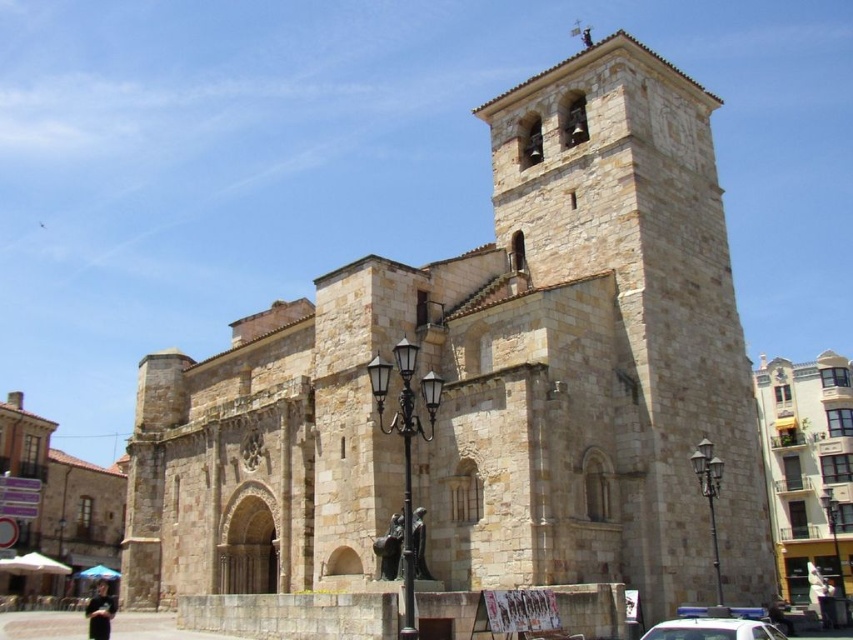
This screenshot has width=853, height=640. Describe the element at coordinates (808, 468) in the screenshot. I see `beige stone church at center` at that location.

Does beige stone church at center have a lesser height compared to white plastic car at center?

No.

Does point (779, 371) lie behind point (730, 627)?

Yes, it is behind point (730, 627).

The height and width of the screenshot is (640, 853). In order to click on beige stone church at center in this screenshot , I will do `click(808, 468)`.